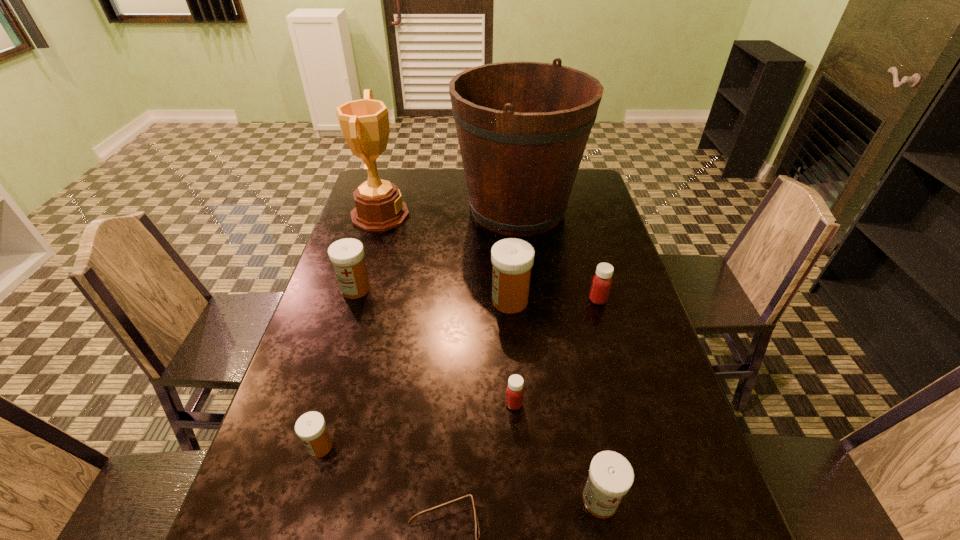
Locate an element on the screen. Image resolution: width=960 pixels, height=540 pixels. medicine identified as the sixth closest to the award is located at coordinates (611, 475).

Find the location of a particular element. The image size is (960, 540). white medicine that is the second nearest to the award is located at coordinates (512, 259).

Where is `white medicine that is the fourth closest to the bucket`? white medicine that is the fourth closest to the bucket is located at coordinates (611, 475).

At what (x,y) coordinates should I click in order to perform the action: click on free space in the image that satisfies the following two spatial constraints: 1. on the front-facing side of the award; 2. on the back side of the nearest medicine. Please return your answer as a coordinate pair (x, y). Looking at the image, I should click on (296, 500).